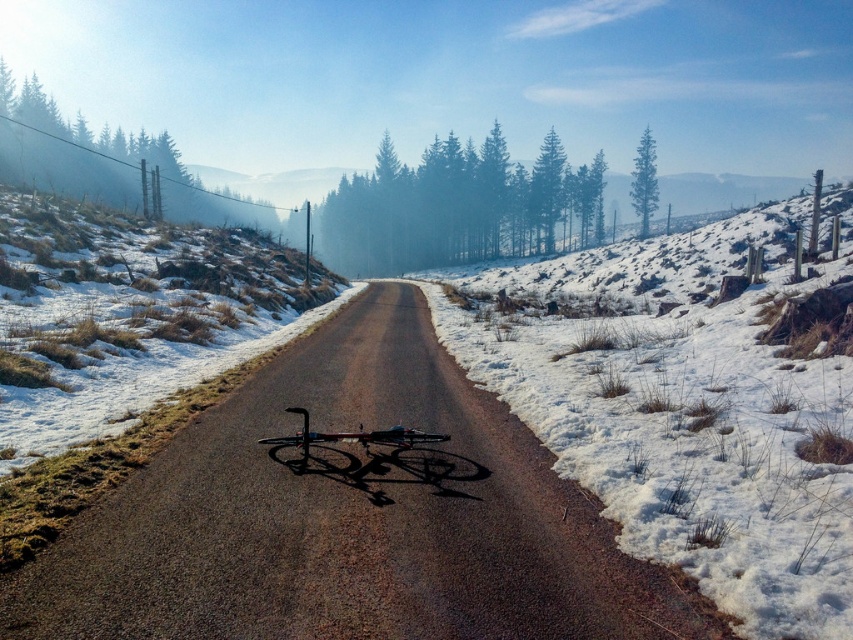
You are standing on the road and want to walk to the shiny metallic bicycle at center. Which direction should you move to avoid stepping on the white fluffy snow at right?

You should move to the left side of the road because the white fluffy snow at right is on the right side, and moving left will keep you away from it while heading toward the bicycle.